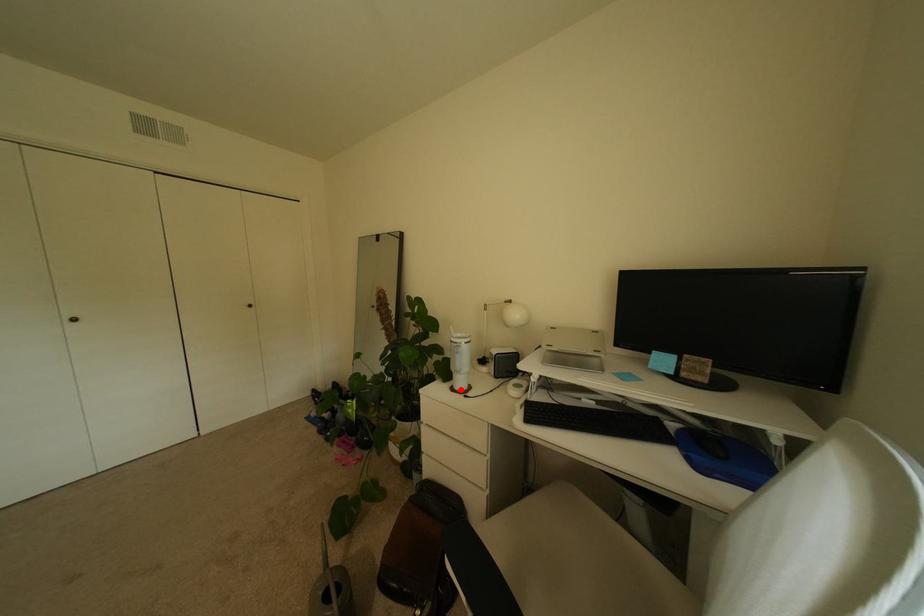
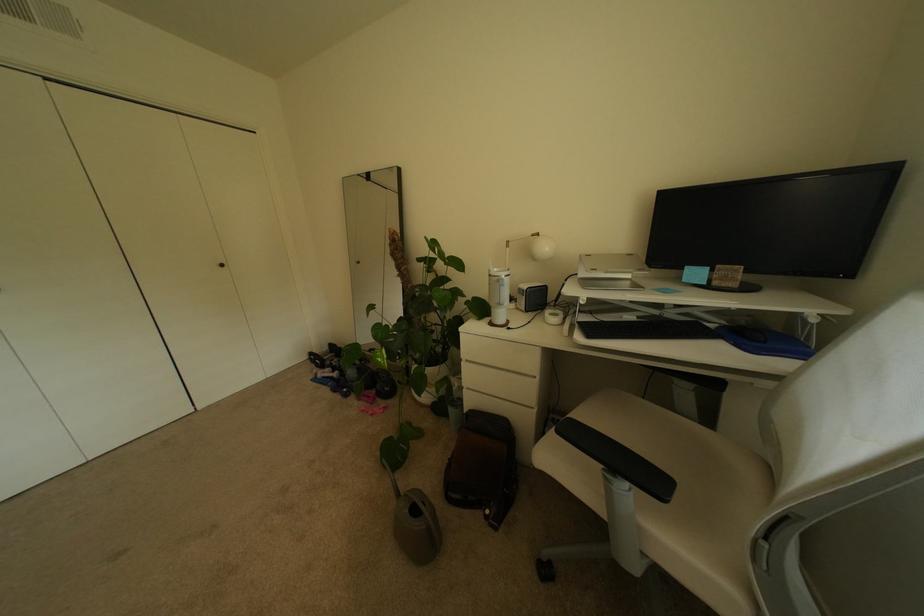
Question: I am providing you with two images of the same scene from different viewpoints. In image1, a red point is highlighted. Considering the same 3D point in image2, which of the following is correct?

Choices:
 (A) It is closer
 (B) It is farther

Answer: (A)